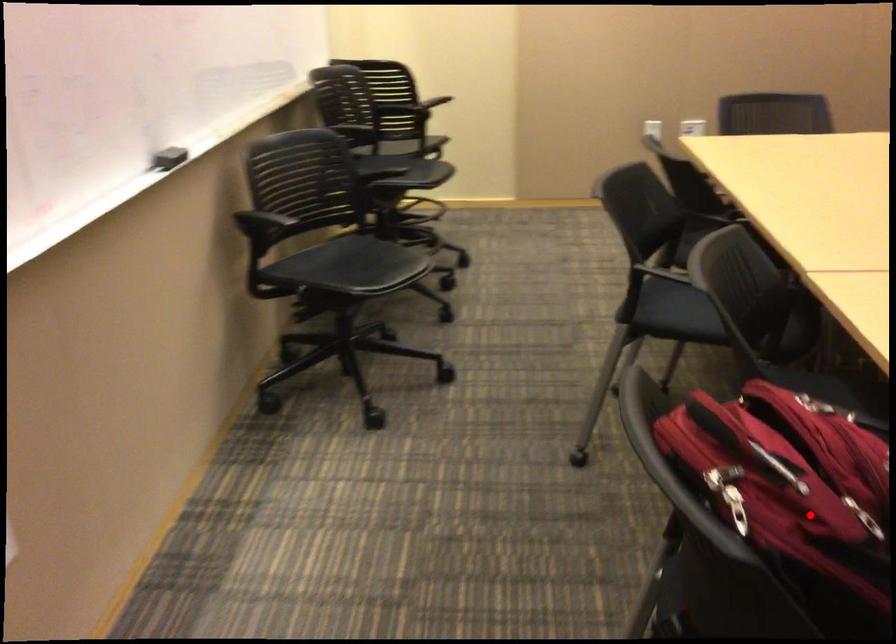
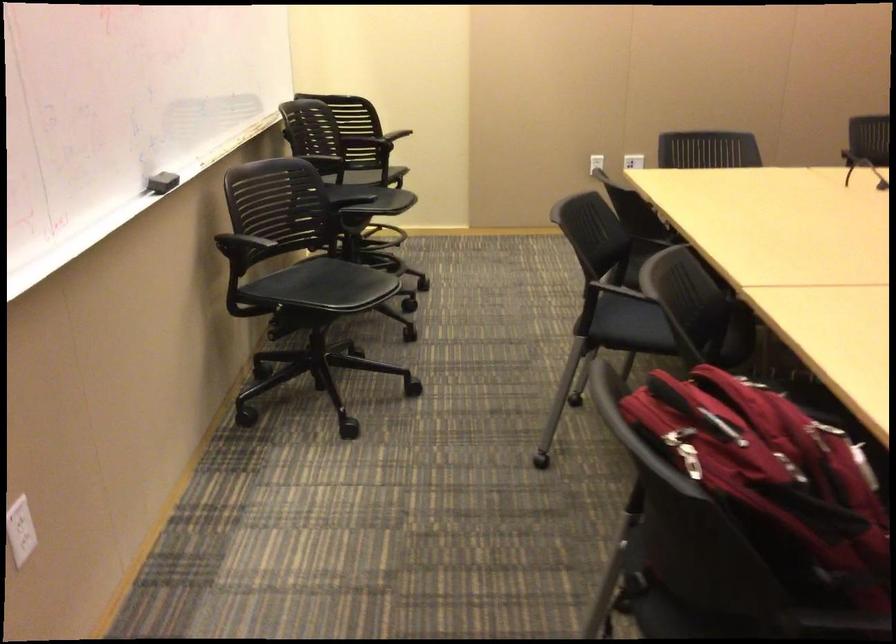
The point at the highlighted location is marked in the first image. Where is the corresponding point in the second image?

(773, 480)